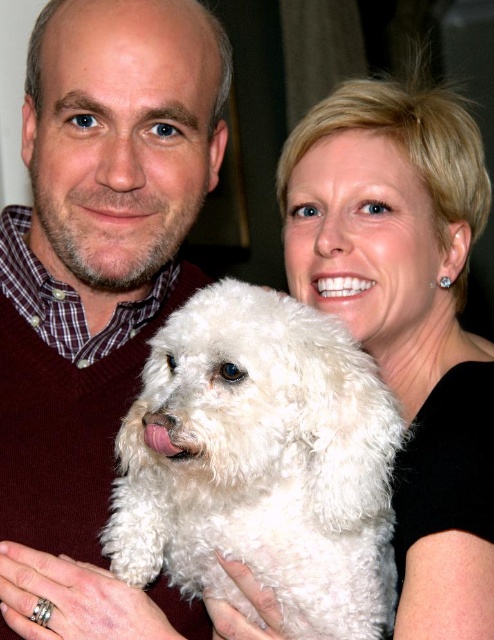
You are a photographer setting up a photo shoot. You need to position a light source so that it illuminates both the matte maroon sweater at left and the white fluffy dog at center without casting harsh shadows. Considering their heights, where should you place the light source?

The matte maroon sweater at left is much taller than the white fluffy dog at center. To avoid harsh shadows, position the light source above both objects, ensuring it illuminates them evenly given the height difference.